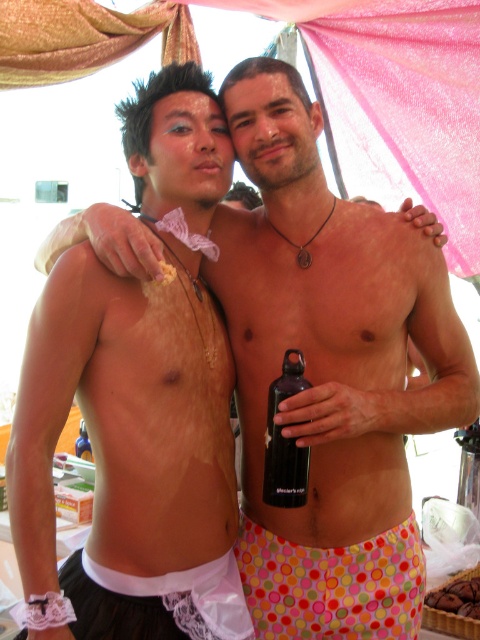
You are a photographer setting up a shoot. You need to position a measuring tape between the polka dot fabric shorts at lower center and the white lace garter at lower left to ensure they are exactly 8 inches apart. Based on the scene, is the current distance sufficient? Please explain.

The distance between the polka dot fabric shorts at lower center and the white lace garter at lower left is 7.91 inches. Since 7.91 inches is just slightly less than 8 inches, the current distance is almost sufficient but falls short by 0.09 inches. To meet the requirement, the photographer should adjust the positioning to increase the gap by approximately 0.09 inches.

You are organizing a beach picnic and need to pack both the white lace garter at lower left and the black matte water bottle at center into a small bag. Given their sizes, which item will require more horizontal space in the bag?

The white lace garter at lower left requires more horizontal space because its width is larger than the black matte water bottle at center.

You are a photographer setting up a shot of the two people under the canopy. You need to adjust the camera focus so that both the white lace garter at lower left and the black matte water bottle at center are in focus. Which object should you focus on first to ensure both are sharp?

You should focus on the white lace garter at lower left first because the black matte water bottle at center is behind it, so adjusting focus starting from the closer object ensures both are in focus.